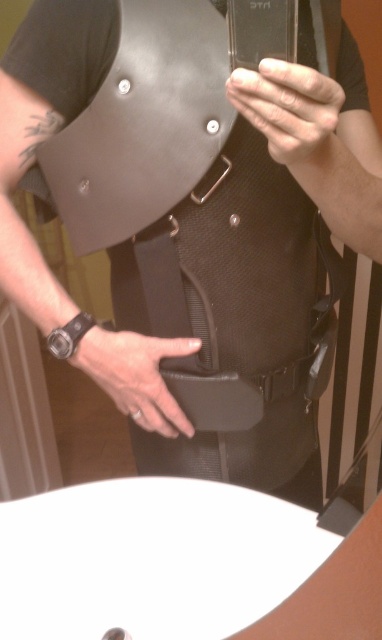
You are trying to take a selfie with your phone. The point on your vest that you want to highlight is at coordinate point [325,102]. If the camera can only focus on objects within 18 inches, will the point be in focus?

The point at coordinate [325,102] is 19.35 inches from the camera, which is beyond the 18 inches focus range. Therefore, the point will not be in focus.

You are a photographer assisting someone taking a mirror selfie. The person wants to ensure their smooth skin hand at upper center is clearly visible in the photo. Given that the hand is 45.52 centimeters away from the viewer, what adjustment should you suggest to ensure it appears sharp and in focus?

The smooth skin hand at upper center is 45.52 centimeters from the viewer. To ensure it appears sharp and in focus, adjust the camera focus to the exact distance of 45.52 centimeters where the hand is located.

In the scene where a person is taking a mirror selfie, you notice two items in the image. One is the smooth skin hand at upper center and the other is the leather at center. Which object is located above the other?

The smooth skin hand at upper center is positioned over leather at center, meaning it is above the leather at center.